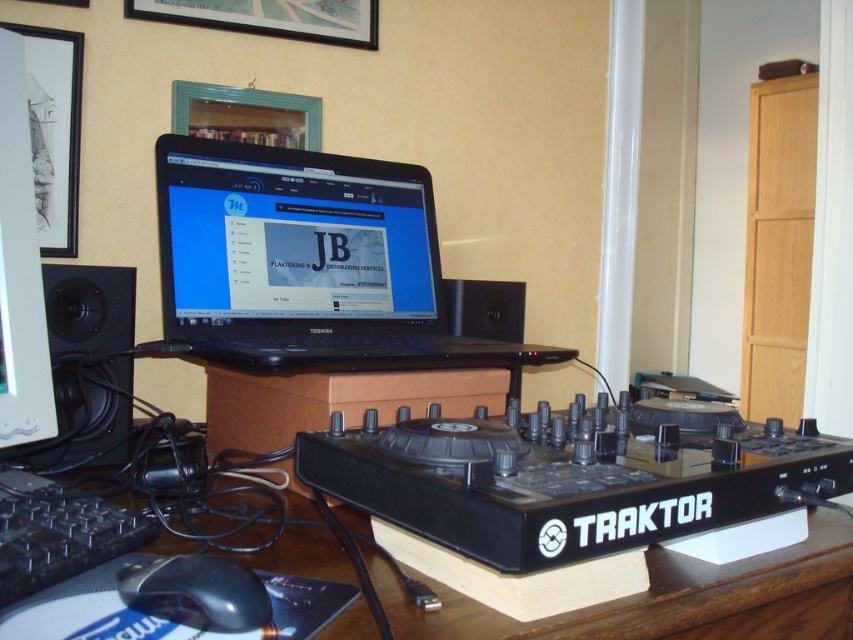
Question: From the image, what is the correct spatial relationship of black plastic laptop at center in relation to black matte speaker at left?

Choices:
 (A) right
 (B) left

Answer: (A)

Question: Is the position of black plastic laptop at center less distant than that of black plastic speaker at center?

Choices:
 (A) no
 (B) yes

Answer: (B)

Question: Which of the following is the closest to the observer?

Choices:
 (A) (189, 605)
 (B) (503, 326)
 (C) (9, 472)
 (D) (125, 292)

Answer: (A)

Question: Does black plastic laptop at center have a greater width compared to white glossy paper at left?

Choices:
 (A) no
 (B) yes

Answer: (B)

Question: Which point is closer to the camera?

Choices:
 (A) (309, 540)
 (B) (10, 502)

Answer: (B)

Question: Which point is closer to the camera taking this photo?

Choices:
 (A) (125, 520)
 (B) (483, 317)

Answer: (A)